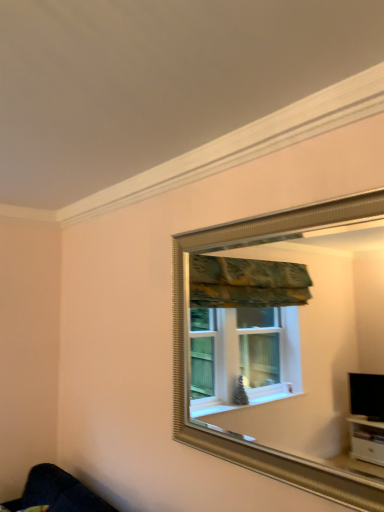
What do you see at coordinates (297, 347) in the screenshot? The width and height of the screenshot is (384, 512). I see `gold textured mirror at upper center` at bounding box center [297, 347].

Identify the location of gold textured mirror at upper center. (297, 347).

At what (x,y) coordinates should I click in order to perform the action: click on gold textured mirror at upper center. Please return your answer as a coordinate pair (x, y). Looking at the image, I should click on (297, 347).